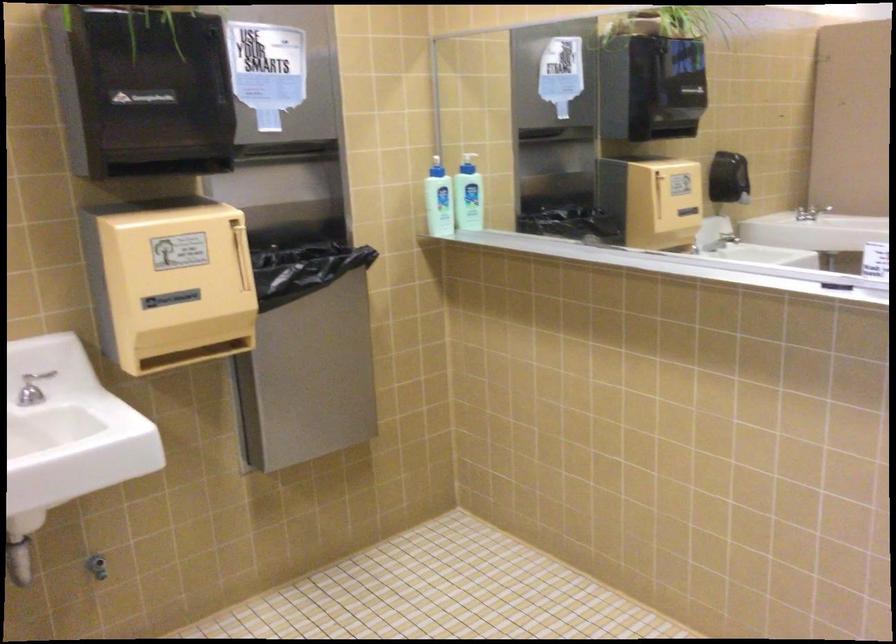
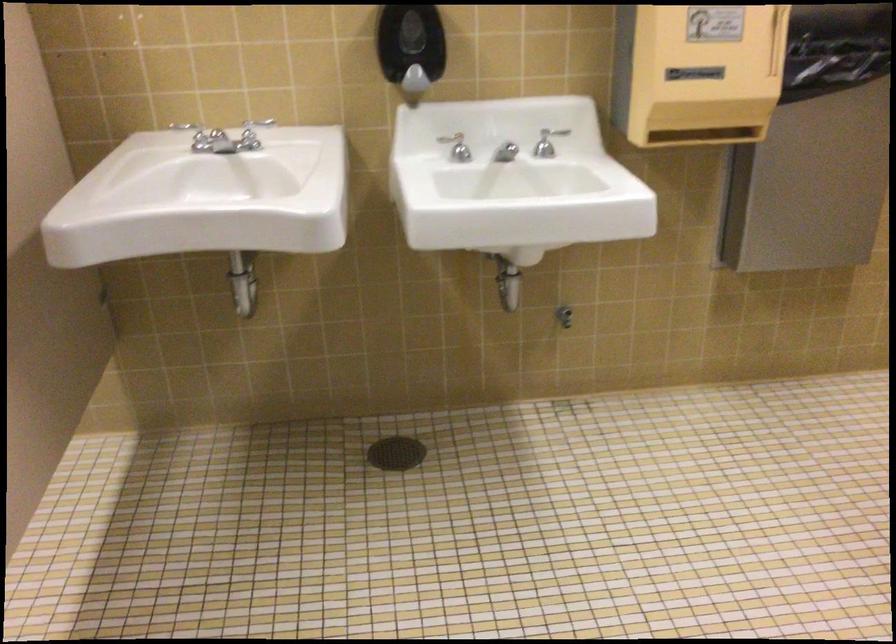
Question: How did the camera likely rotate?

Choices:
 (A) Left
 (B) Right
 (C) Up
 (D) Down

Answer: (A)